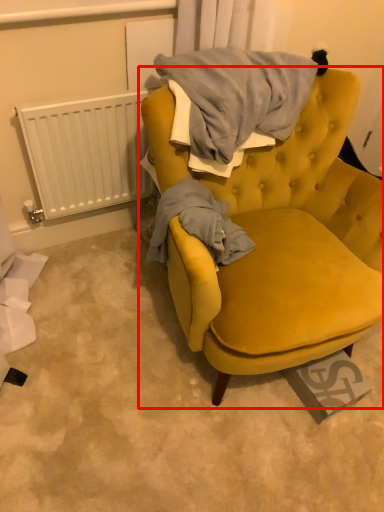
Question: Considering the relative positions of chair (annotated by the red box) and radiator in the image provided, where is chair (annotated by the red box) located with respect to the staircase?

Choices:
 (A) left
 (B) right

Answer: (B)